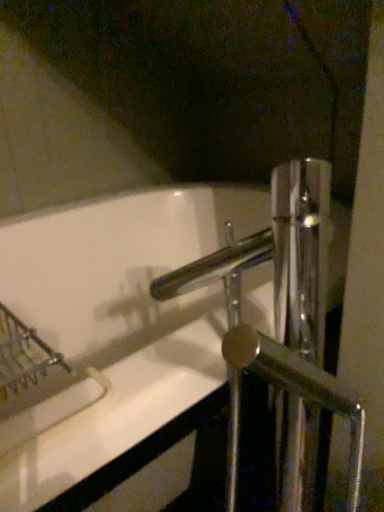
Image resolution: width=384 pixels, height=512 pixels. What do you see at coordinates (144, 316) in the screenshot? I see `white glossy sink at center` at bounding box center [144, 316].

You are a GUI agent. You are given a task and a screenshot of the screen. Output one action in this format:
    pyautogui.click(x=<x>, y=<y>)
    Task: Click on the white glossy sink at center
    
    Given the screenshot: What is the action you would take?
    pyautogui.click(x=144, y=316)

You are a GUI agent. You are given a task and a screenshot of the screen. Output one action in this format:
    pyautogui.click(x=<x>, y=<y>)
    Task: Click on the white glossy sink at center
    This screenshot has width=384, height=512.
    Given the screenshot: What is the action you would take?
    pyautogui.click(x=144, y=316)